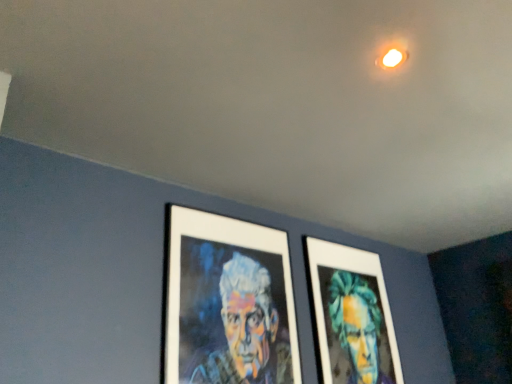
Question: Considering the positions of point (351, 340) and point (257, 321), is point (351, 340) closer or farther from the camera than point (257, 321)?

Choices:
 (A) closer
 (B) farther

Answer: (B)

Question: Is matte green portrait at center, the 1th person in the right-to-left sequence, inside the boundaries of multicolored canvas portrait at center, the second person from the right, or outside?

Choices:
 (A) outside
 (B) inside

Answer: (A)

Question: Based on their sizes in the image, would you say matte green portrait at center, the second person from the left, is bigger or smaller than multicolored canvas portrait at center, which is the first person from left to right?

Choices:
 (A) small
 (B) big

Answer: (B)

Question: Is point (285, 337) closer or farther from the camera than point (366, 364)?

Choices:
 (A) farther
 (B) closer

Answer: (B)

Question: Would you say multicolored canvas portrait at center, the second person from the right, is to the left or to the right of matte green portrait at center, the 1th person in the right-to-left sequence, in the picture?

Choices:
 (A) left
 (B) right

Answer: (A)

Question: Which is correct: multicolored canvas portrait at center, the second person from the right, is inside matte green portrait at center, the second person from the left, or outside of it?

Choices:
 (A) outside
 (B) inside

Answer: (A)

Question: From a real-world perspective, relative to matte green portrait at center, the 1th person in the right-to-left sequence, is multicolored canvas portrait at center, which is the first person from left to right, vertically above or below?

Choices:
 (A) above
 (B) below

Answer: (A)